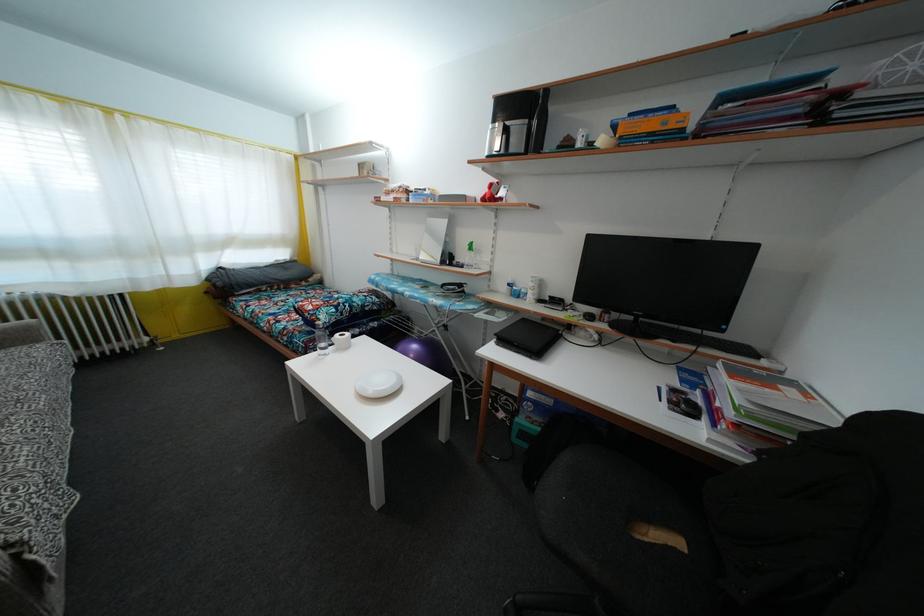
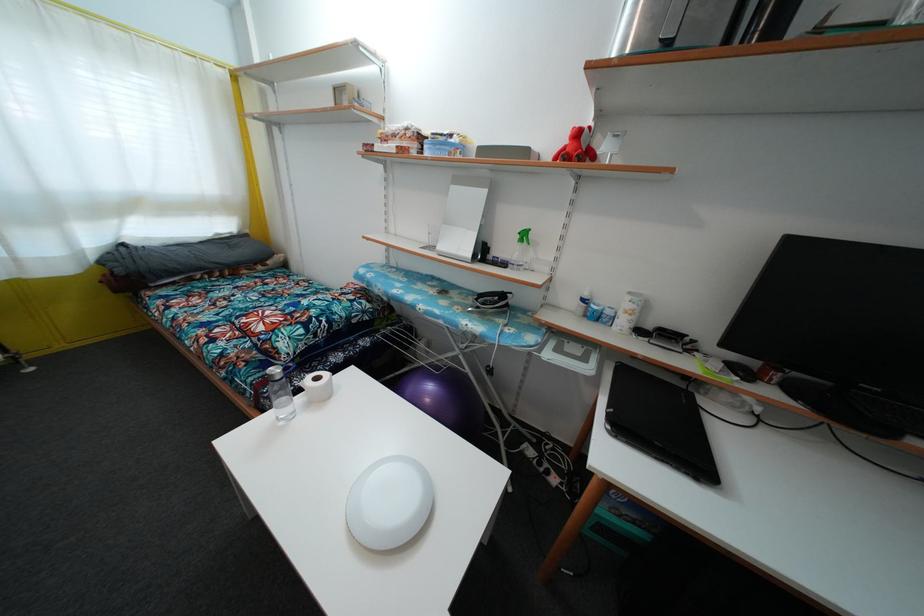
Find the pixel in the second image that matches point (552, 305) in the first image.

(652, 334)